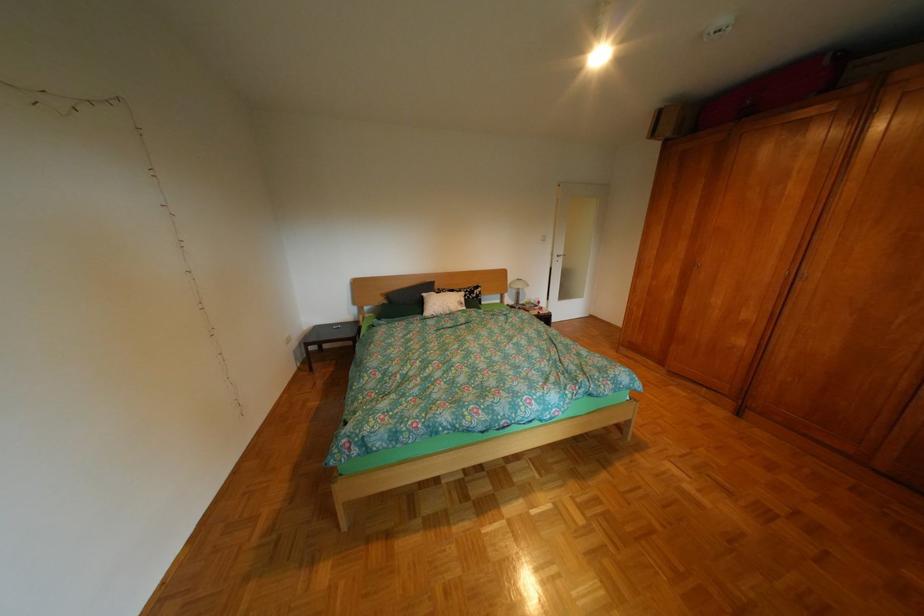
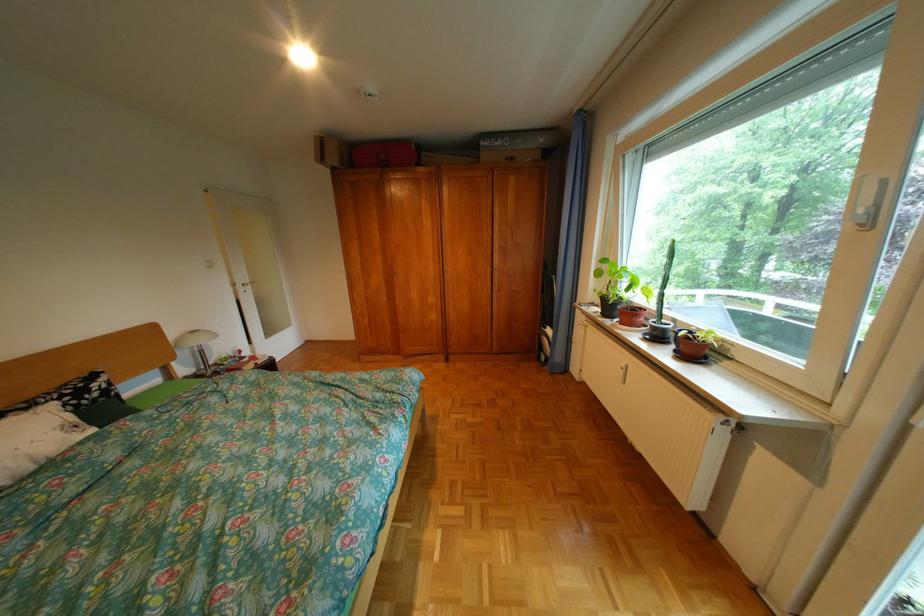
Where in the second image is the point corresponding to point 684,136 from the first image?

(350, 164)